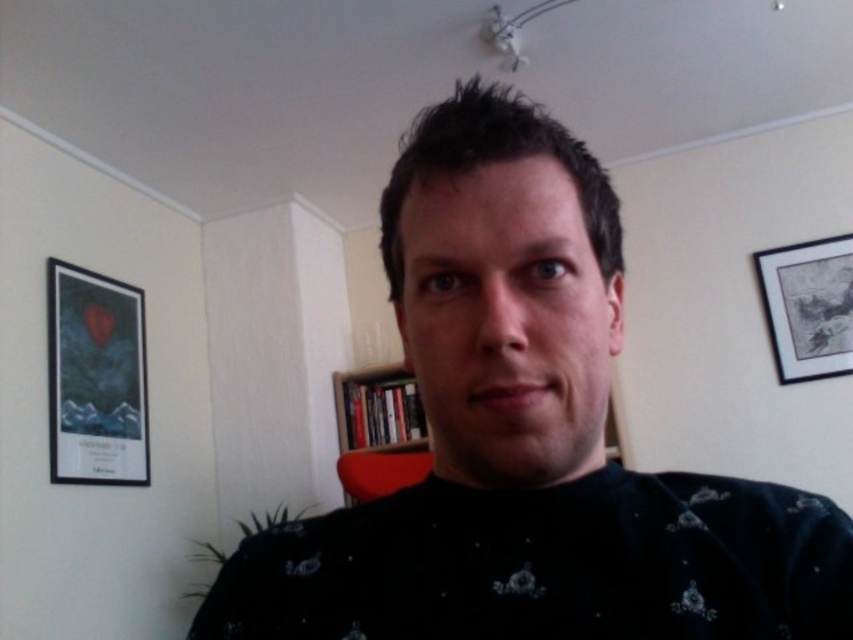
Looking at this image, is dark blue sweater at center to the right of matte black picture frame at upper right from the viewer's perspective?

Incorrect, dark blue sweater at center is not on the right side of matte black picture frame at upper right.

Can you confirm if dark blue sweater at center is bigger than matte black picture frame at upper right?

No.

Does point (524, 371) lie behind point (769, 296)?

No.

The height and width of the screenshot is (640, 853). I want to click on dark blue sweater at center, so click(x=527, y=438).

Between point (793, 326) and point (373, 401), which one is positioned in front?

Point (793, 326) is more forward.

Image resolution: width=853 pixels, height=640 pixels. I want to click on matte black picture frame at upper right, so click(808, 307).

Looking at this image, is matte black picture frame at left wider than wooden bookshelf at center?

No.

Which is more to the left, matte black picture frame at left or wooden bookshelf at center?

matte black picture frame at left

Measure the distance between point (49, 268) and camera.

The distance of point (49, 268) from camera is 7.98 feet.

I want to click on matte black picture frame at left, so click(x=96, y=378).